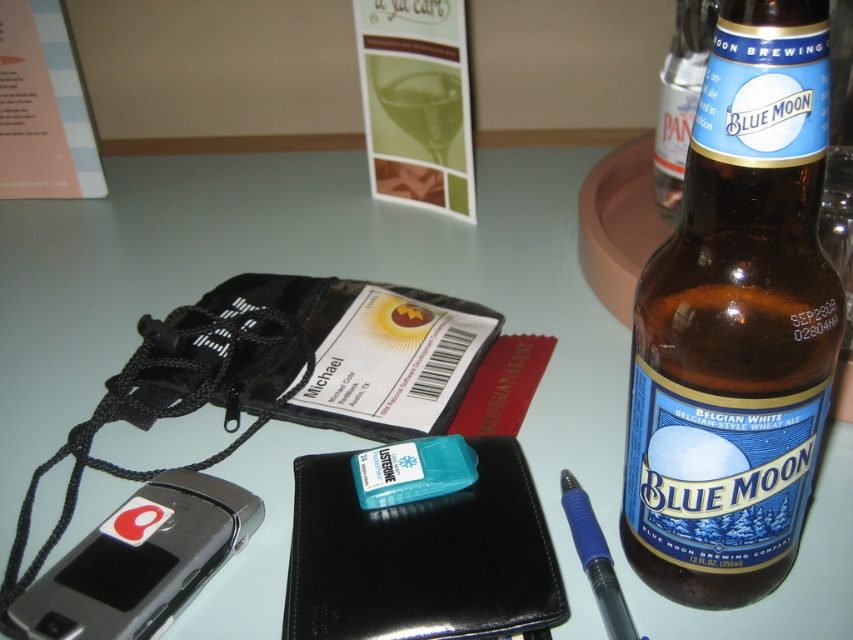
You are organizing items on a table and need to place the green glass at upper center and the blue rubberized pen at right. Which object is taller?

The green glass at upper center is taller than the blue rubberized pen at right according to the description.

You are a delivery person who needs to place a package on the table without touching any items. The package is 40 centimeters long. Is there enough space between the brown glass bottle at right and the edge of the table to place the package?

The brown glass bottle at right is 42.00 centimeters away from viewer, so yes, there is enough space to place the 40 centimeter long package between the brown glass bottle at right and the edge of the table since the distance is greater than the package length.

You are organizing items on a table and need to place the green glass at upper center and the blue rubberized pen at right into a drawer. The drawer has a height limit of 10 cm. Can both items fit vertically without bending or damaging them?

The green glass at upper center is larger in size than the blue rubberized pen at right. Since the drawer has a height limit of 10 cm, we need to know the exact heights of both items. However, the description only states their relative sizes. Without specific measurements, it is impossible to determine if both can fit vertically within the 10 cm height limit.